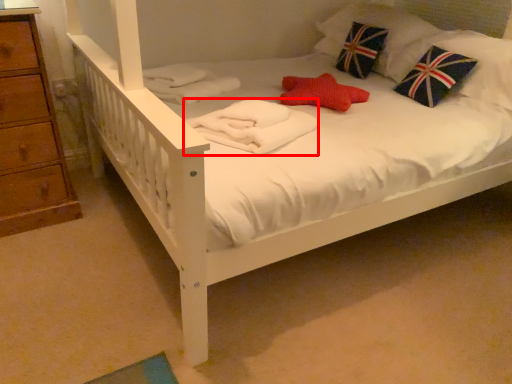
Question: From the image's perspective, where is material (annotated by the red box) located relative to pillow?

Choices:
 (A) above
 (B) below

Answer: (B)